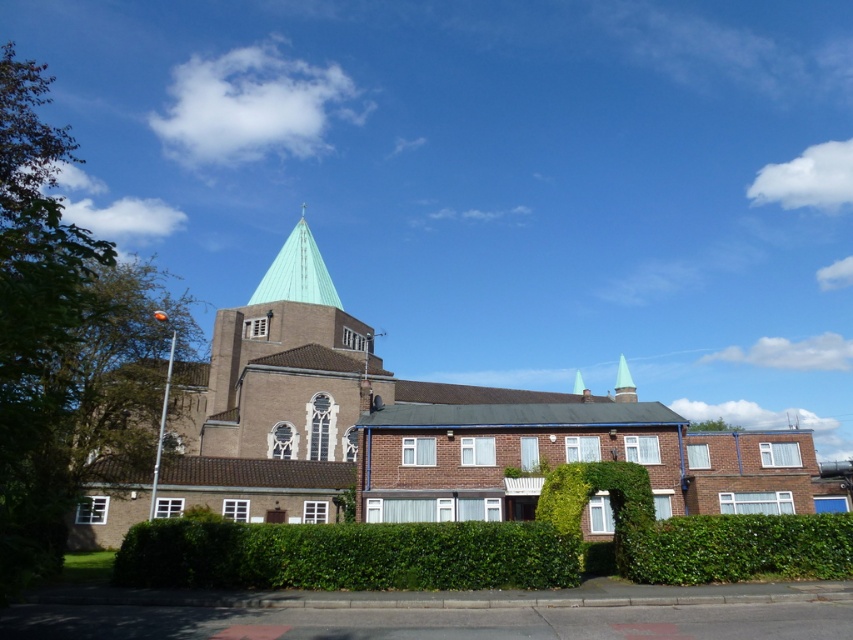
You are a drone operator planning to fly a drone from the brown brick church at center to the green glass spire at upper center. Considering the height difference between them, will the drone need to ascend or descend to reach its destination?

The brown brick church at center is much taller than the green glass spire at upper center, so the drone will need to descend to reach the green glass spire at upper center.

You are an architect analyzing the image of two green spires. The green metallic spire at upper center and the green glass spire at upper center are both visible. Which of these two spires is positioned more to the left side of the image?

The green metallic spire at upper center is positioned more to the left side of the image compared to the green glass spire at upper center.